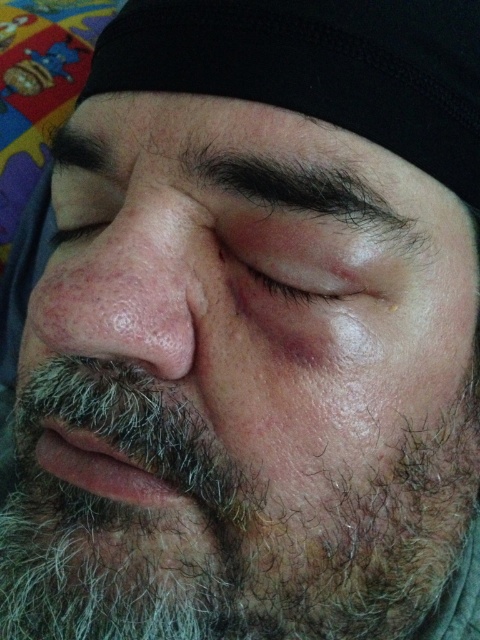
Question: Which point is farther to the camera?

Choices:
 (A) gray/woolly beard at lower left
 (B) dry skin at center
 (C) dark brown hair at upper center
 (D) pink matte nose at center

Answer: (A)

Question: Which of the following is the closest to the observer?

Choices:
 (A) (90, 232)
 (B) (267, 285)
 (C) (230, 477)

Answer: (B)

Question: Where is gray/woolly beard at lower left located in relation to matte skin at left in the image?

Choices:
 (A) left
 (B) right

Answer: (B)

Question: Is dark brown hair at upper center above matte skin at left?

Choices:
 (A) no
 (B) yes

Answer: (B)

Question: Among these objects, which one is farthest from the camera?

Choices:
 (A) dry skin at center
 (B) matte skin at left
 (C) pink matte nose at center

Answer: (B)

Question: Does gray/woolly beard at lower left have a smaller size compared to pink matte nose at center?

Choices:
 (A) no
 (B) yes

Answer: (A)